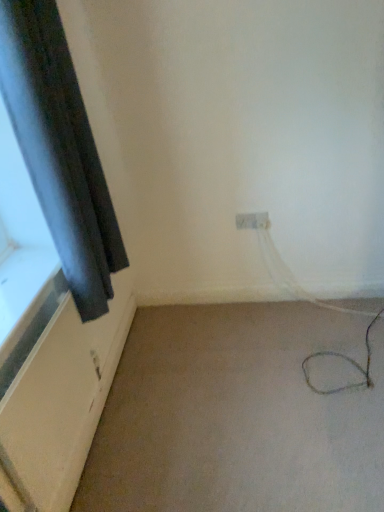
Describe the element at coordinates (252, 220) in the screenshot. I see `white plastic electric outlet at center` at that location.

The image size is (384, 512). What do you see at coordinates (236, 416) in the screenshot?
I see `beige carpet at lower right` at bounding box center [236, 416].

Locate an element on the screen. The image size is (384, 512). white plastic electric outlet at center is located at coordinates (252, 220).

Is beige carpet at lower right wider or thinner than black matte curtain at left?

Considering their sizes, beige carpet at lower right looks broader than black matte curtain at left.

From their relative heights in the image, would you say beige carpet at lower right is taller or shorter than black matte curtain at left?

beige carpet at lower right is shorter than black matte curtain at left.

From the image's perspective, is beige carpet at lower right positioned above or below black matte curtain at left?

Based on their image positions, beige carpet at lower right is located beneath black matte curtain at left.

Is beige carpet at lower right not near black matte curtain at left?

No, beige carpet at lower right is in close proximity to black matte curtain at left.

Are black matte curtain at left and beige carpet at lower right far apart?

No, black matte curtain at left is not far from beige carpet at lower right.

Based on the photo, could you tell me if black matte curtain at left is turned towards beige carpet at lower right?

No, black matte curtain at left is not oriented towards beige carpet at lower right.

Between point (112, 289) and point (179, 439), which one is positioned behind?

The point (112, 289) is farther.

Is beige carpet at lower right a part of black matte curtain at left?

No, beige carpet at lower right is not inside black matte curtain at left.

Looking at their sizes, would you say black matte curtain at left is wider or thinner than white plastic electric outlet at center?

black matte curtain at left is wider than white plastic electric outlet at center.

From a real-world perspective, does black matte curtain at left stand above white plastic electric outlet at center?

Yes, from a real-world perspective, black matte curtain at left is on top of white plastic electric outlet at center.

From the image's perspective, is black matte curtain at left located beneath white plastic electric outlet at center?

No, from the image's perspective, black matte curtain at left is not beneath white plastic electric outlet at center.

Find the location of a particular element. electric outlet directly beneath the black matte curtain at left (from a real-world perspective) is located at coordinates (252, 220).

From the image's perspective, which one is positioned lower, beige carpet at lower right or white plastic electric outlet at center?

beige carpet at lower right appears lower in the image.

Is beige carpet at lower right next to white plastic electric outlet at center?

No.

Which is closer to the camera, (251, 509) or (251, 215)?

The point (251, 509) is more forward.

Could you tell me if white plastic electric outlet at center is facing beige carpet at lower right?

No, white plastic electric outlet at center does not turn towards beige carpet at lower right.

Is white plastic electric outlet at center smaller than beige carpet at lower right?

Correct, white plastic electric outlet at center occupies less space than beige carpet at lower right.

Considering their positions, is white plastic electric outlet at center located in front of or behind beige carpet at lower right?

Clearly, white plastic electric outlet at center is behind beige carpet at lower right.

Who is shorter, white plastic electric outlet at center or beige carpet at lower right?

beige carpet at lower right.

At what (x,y) coordinates should I click in order to perform the action: click on electric outlet directly beneath the black matte curtain at left (from a real-world perspective). Please return your answer as a coordinate pair (x, y). This screenshot has width=384, height=512. Looking at the image, I should click on (252, 220).

Which of these two, white plastic electric outlet at center or black matte curtain at left, stands shorter?

With less height is white plastic electric outlet at center.

Is white plastic electric outlet at center oriented away from black matte curtain at left?

No, black matte curtain at left is not at the back of white plastic electric outlet at center.

Find the location of a particular element. The height and width of the screenshot is (512, 384). plain lying on the right of black matte curtain at left is located at coordinates (236, 416).

This screenshot has width=384, height=512. I want to click on curtain that is on the left side of beige carpet at lower right, so click(x=60, y=150).

Which object lies nearer to the anchor point white plastic electric outlet at center, black matte curtain at left or beige carpet at lower right?

The object closer to white plastic electric outlet at center is beige carpet at lower right.

Based on their spatial positions, is white plastic electric outlet at center or black matte curtain at left further from beige carpet at lower right?

Among the two, black matte curtain at left is located further to beige carpet at lower right.

Looking at the image, which one is located closer to white plastic electric outlet at center, beige carpet at lower right or black matte curtain at left?

Among the two, beige carpet at lower right is located nearer to white plastic electric outlet at center.

Estimate the real-world distances between objects in this image. Which object is further from black matte curtain at left, beige carpet at lower right or white plastic electric outlet at center?

white plastic electric outlet at center is further to black matte curtain at left.

Estimate the real-world distances between objects in this image. Which object is closer to beige carpet at lower right, black matte curtain at left or white plastic electric outlet at center?

white plastic electric outlet at center.

Which object lies nearer to the anchor point black matte curtain at left, white plastic electric outlet at center or beige carpet at lower right?

Based on the image, beige carpet at lower right appears to be nearer to black matte curtain at left.

The image size is (384, 512). Identify the location of plain located between black matte curtain at left and white plastic electric outlet at center in the depth direction. (236, 416).